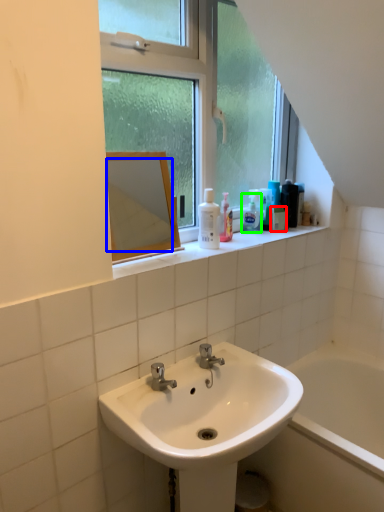
Question: Estimate the real-world distances between objects in this image. Which object is closer to mouthwash (highlighted by a red box), mirror (highlighted by a blue box) or soap dispenser (highlighted by a green box)?

Choices:
 (A) mirror
 (B) soap dispenser

Answer: (B)